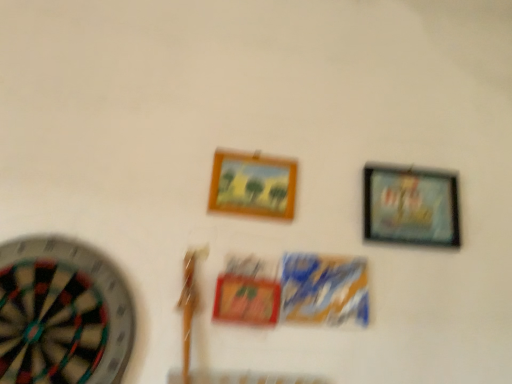
In order to face wooden frame at center, which is the second picture frame from right to left, should I rotate leftwards or rightwards?

You should rotate right by 0.186 degrees.

Image resolution: width=512 pixels, height=384 pixels. Find the location of `multicolored felt dartboard at left`. multicolored felt dartboard at left is located at coordinates pos(62,314).

Is multicolored felt dartboard at left next to metallic silver picture frame at upper right, the 2th picture frame positioned from the left?

No, multicolored felt dartboard at left is not making contact with metallic silver picture frame at upper right, the 2th picture frame positioned from the left.

The image size is (512, 384). I want to click on wheel located on the left of metallic silver picture frame at upper right, the 1th picture frame positioned from the right, so click(x=62, y=314).

From a real-world perspective, between multicolored felt dartboard at left and metallic silver picture frame at upper right, the 2th picture frame positioned from the left, who is vertically higher?

From a 3D spatial view, metallic silver picture frame at upper right, the 2th picture frame positioned from the left, is above.

From the image's perspective, which object appears higher, metallic silver picture frame at upper right, the 1th picture frame positioned from the right, or multicolored felt dartboard at left?

From the image's view, metallic silver picture frame at upper right, the 1th picture frame positioned from the right, is above.

Considering the sizes of metallic silver picture frame at upper right, the 2th picture frame positioned from the left, and multicolored felt dartboard at left in the image, is metallic silver picture frame at upper right, the 2th picture frame positioned from the left, taller or shorter than multicolored felt dartboard at left?

Considering their sizes, metallic silver picture frame at upper right, the 2th picture frame positioned from the left, has less height than multicolored felt dartboard at left.

Is metallic silver picture frame at upper right, the 2th picture frame positioned from the left, inside or outside of multicolored felt dartboard at left?

metallic silver picture frame at upper right, the 2th picture frame positioned from the left, exists outside the volume of multicolored felt dartboard at left.

Are wooden frame at center, which is the second picture frame from right to left, and metallic silver picture frame at upper right, the 2th picture frame positioned from the left, located far from each other?

No, wooden frame at center, which is the second picture frame from right to left, is not far away from metallic silver picture frame at upper right, the 2th picture frame positioned from the left.

Based on the photo, does wooden frame at center, which is the second picture frame from right to left, have a lesser height compared to metallic silver picture frame at upper right, the 1th picture frame positioned from the right?

Indeed, wooden frame at center, which is the second picture frame from right to left, has a lesser height compared to metallic silver picture frame at upper right, the 1th picture frame positioned from the right.

Looking at this image, is wooden frame at center, which is the second picture frame from right to left, facing towards metallic silver picture frame at upper right, the 1th picture frame positioned from the right?

No, wooden frame at center, which is the second picture frame from right to left, is not aimed at metallic silver picture frame at upper right, the 1th picture frame positioned from the right.

Based on the photo, is multicolored felt dartboard at left outside of wooden frame at center, which is counted as the first picture frame, starting from the left?

That's correct, multicolored felt dartboard at left is outside of wooden frame at center, which is counted as the first picture frame, starting from the left.

Is multicolored felt dartboard at left far from wooden frame at center, which is counted as the first picture frame, starting from the left?

No, multicolored felt dartboard at left is not far from wooden frame at center, which is counted as the first picture frame, starting from the left.

From the image's perspective, does multicolored felt dartboard at left appear lower than wooden frame at center, which is the second picture frame from right to left?

Correct, multicolored felt dartboard at left appears lower than wooden frame at center, which is the second picture frame from right to left, in the image.

Is multicolored felt dartboard at left turned away from wooden frame at center, which is counted as the first picture frame, starting from the left?

multicolored felt dartboard at left does not have its back to wooden frame at center, which is counted as the first picture frame, starting from the left.

Looking at this image, from the image's perspective, who appears lower, wooden frame at center, which is the second picture frame from right to left, or multicolored felt dartboard at left?

multicolored felt dartboard at left, from the image's perspective.

Would you say wooden frame at center, which is counted as the first picture frame, starting from the left, contains multicolored felt dartboard at left?

No, multicolored felt dartboard at left is located outside of wooden frame at center, which is counted as the first picture frame, starting from the left.

Are wooden frame at center, which is counted as the first picture frame, starting from the left, and multicolored felt dartboard at left making contact?

No, wooden frame at center, which is counted as the first picture frame, starting from the left, is not next to multicolored felt dartboard at left.

In the scene shown: How many degrees apart are the facing directions of metallic silver picture frame at upper right, the 1th picture frame positioned from the right, and wooden frame at center, which is counted as the first picture frame, starting from the left?

The angular difference between metallic silver picture frame at upper right, the 1th picture frame positioned from the right, and wooden frame at center, which is counted as the first picture frame, starting from the left, is 0.42 degrees.

From the image's perspective, is metallic silver picture frame at upper right, the 1th picture frame positioned from the right, below wooden frame at center, which is counted as the first picture frame, starting from the left?

Correct, metallic silver picture frame at upper right, the 1th picture frame positioned from the right, appears lower than wooden frame at center, which is counted as the first picture frame, starting from the left, in the image.

Between metallic silver picture frame at upper right, the 1th picture frame positioned from the right, and wooden frame at center, which is counted as the first picture frame, starting from the left, which one has more height?

With more height is metallic silver picture frame at upper right, the 1th picture frame positioned from the right.

Is there a large distance between metallic silver picture frame at upper right, the 2th picture frame positioned from the left, and wooden frame at center, which is the second picture frame from right to left?

No, metallic silver picture frame at upper right, the 2th picture frame positioned from the left, is not far away from wooden frame at center, which is the second picture frame from right to left.

You are a GUI agent. You are given a task and a screenshot of the screen. Output one action in this format:
    pyautogui.click(x=<x>, y=<y>)
    Task: Click on the wheel in front of the metallic silver picture frame at upper right, the 2th picture frame positioned from the left
    
    Given the screenshot: What is the action you would take?
    pyautogui.click(x=62, y=314)

Find the location of a particular element. The height and width of the screenshot is (384, 512). wheel below the metallic silver picture frame at upper right, the 2th picture frame positioned from the left (from the image's perspective) is located at coordinates (62, 314).

From the image, which object appears to be farther from multicolored felt dartboard at left, wooden frame at center, which is the second picture frame from right to left, or metallic silver picture frame at upper right, the 1th picture frame positioned from the right?

Among the two, metallic silver picture frame at upper right, the 1th picture frame positioned from the right, is located further to multicolored felt dartboard at left.

Estimate the real-world distances between objects in this image. Which object is closer to multicolored felt dartboard at left, metallic silver picture frame at upper right, the 1th picture frame positioned from the right, or wooden frame at center, which is counted as the first picture frame, starting from the left?

Among the two, wooden frame at center, which is counted as the first picture frame, starting from the left, is located nearer to multicolored felt dartboard at left.

Which object lies nearer to the anchor point wooden frame at center, which is the second picture frame from right to left, metallic silver picture frame at upper right, the 1th picture frame positioned from the right, or multicolored felt dartboard at left?

Based on the image, metallic silver picture frame at upper right, the 1th picture frame positioned from the right, appears to be nearer to wooden frame at center, which is the second picture frame from right to left.

Which object lies nearer to the anchor point metallic silver picture frame at upper right, the 2th picture frame positioned from the left, wooden frame at center, which is the second picture frame from right to left, or multicolored felt dartboard at left?

Based on the image, wooden frame at center, which is the second picture frame from right to left, appears to be nearer to metallic silver picture frame at upper right, the 2th picture frame positioned from the left.

Based on their spatial positions, is multicolored felt dartboard at left or wooden frame at center, which is the second picture frame from right to left, further from metallic silver picture frame at upper right, the 1th picture frame positioned from the right?

multicolored felt dartboard at left.

When comparing their distances from wooden frame at center, which is counted as the first picture frame, starting from the left, does multicolored felt dartboard at left or metallic silver picture frame at upper right, the 1th picture frame positioned from the right, seem further?

multicolored felt dartboard at left.

Locate an element on the screen. This screenshot has height=384, width=512. picture frame located between multicolored felt dartboard at left and metallic silver picture frame at upper right, the 1th picture frame positioned from the right, in the left-right direction is located at coordinates (253, 185).